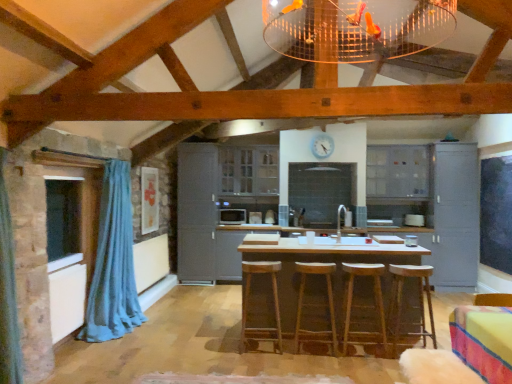
At what (x,y) coordinates should I click in order to perform the action: click on free space in front of brown wooden bar stool at center, placed as the 1th bar stool when sorted from left to right. Please return your answer as a coordinate pair (x, y). The image size is (512, 384). Looking at the image, I should click on (251, 360).